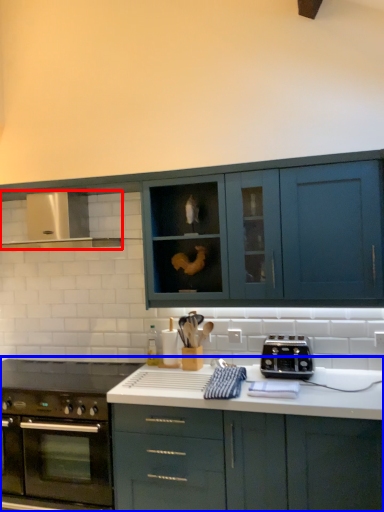
Question: Which point is closer to the camera, exhaust hood (highlighted by a red box) or cabinetry (highlighted by a blue box)?

Choices:
 (A) exhaust hood
 (B) cabinetry

Answer: (B)